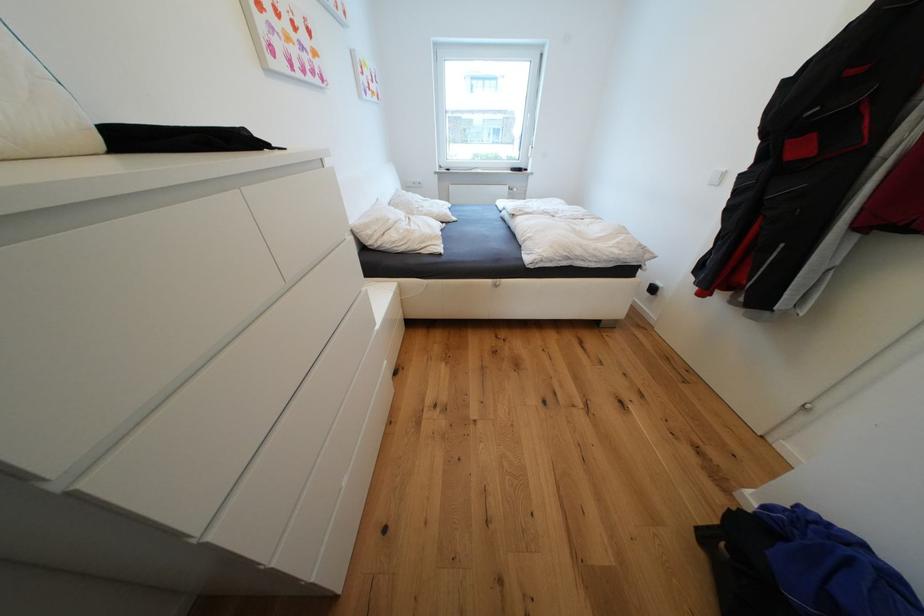
What do you see at coordinates (652, 288) in the screenshot? The width and height of the screenshot is (924, 616). I see `the black power outlet` at bounding box center [652, 288].